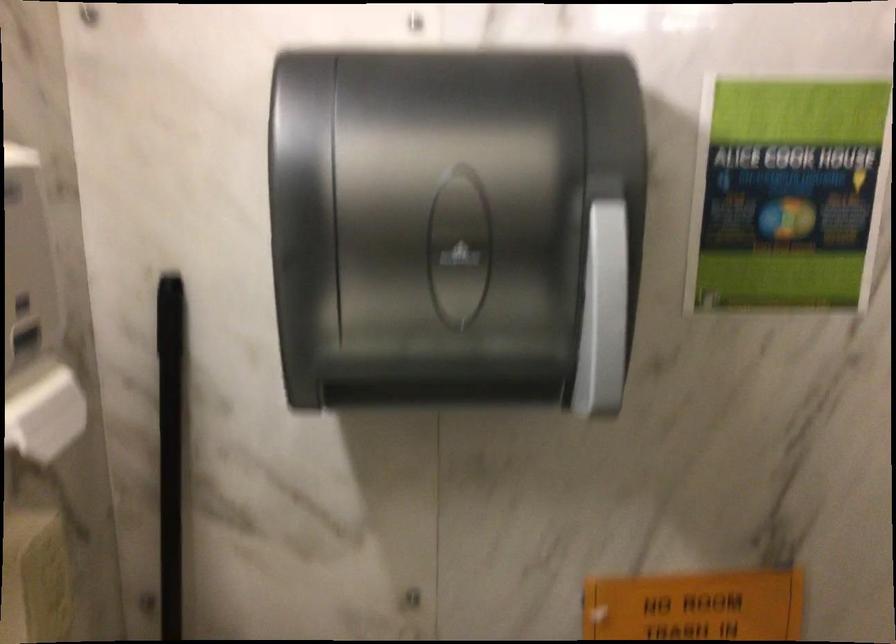
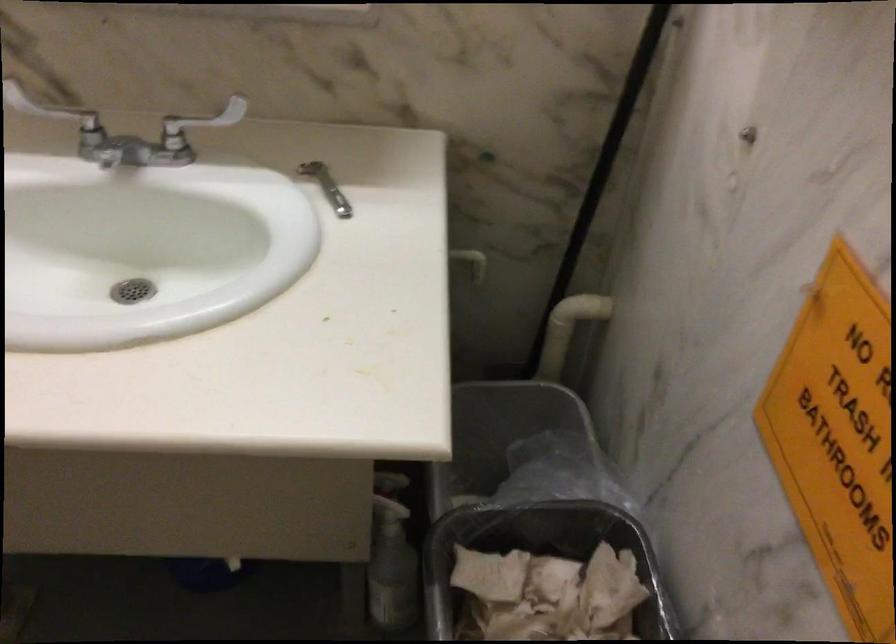
First-person continuous shooting, in which direction is the camera rotating?

The camera's rotation is toward left-down.